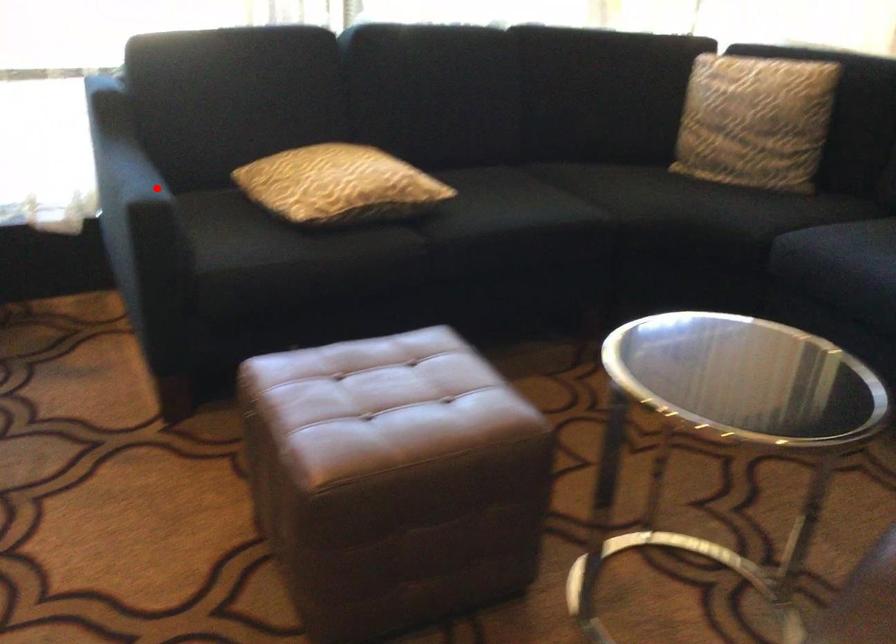
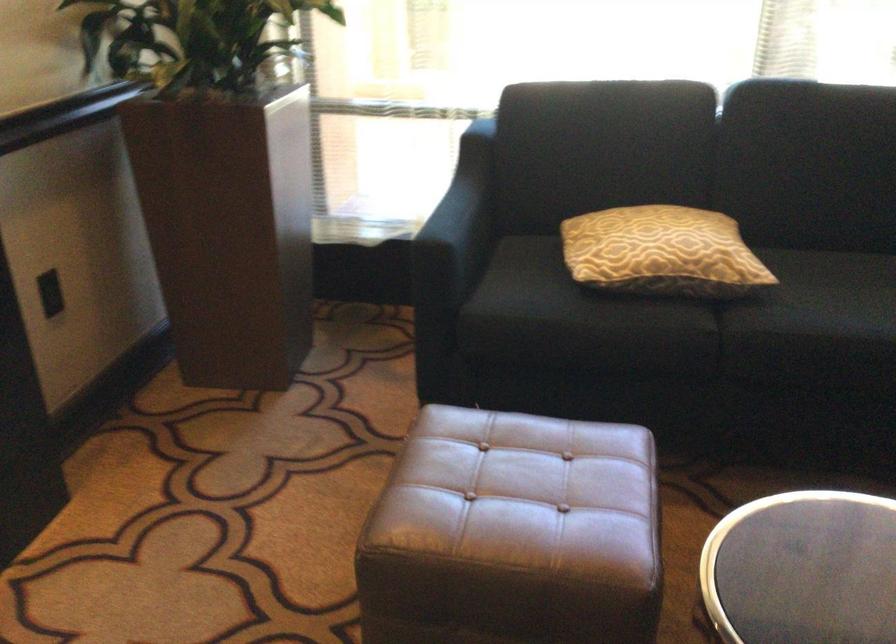
In the second image, find the point that corresponds to the highlighted location in the first image.

(458, 225)